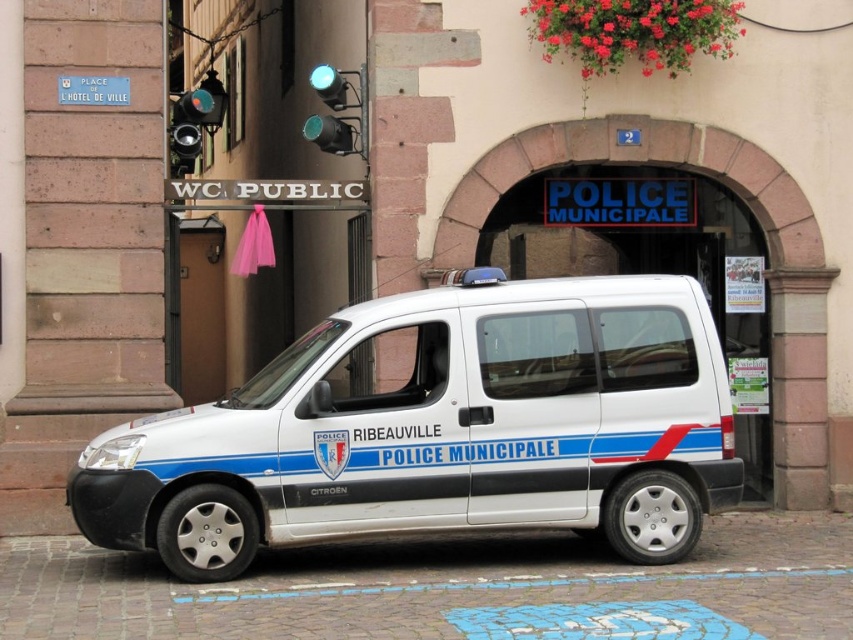
Question: Which point is closer to the camera?

Choices:
 (A) (509, 371)
 (B) (334, 150)

Answer: (A)

Question: Observing the image, what is the correct spatial positioning of white metallic van at center in reference to metallic green traffic light at upper center?

Choices:
 (A) right
 (B) left

Answer: (A)

Question: Is white metallic van at center smaller than metallic green traffic light at upper center?

Choices:
 (A) no
 (B) yes

Answer: (A)

Question: Can you confirm if white metallic van at center is wider than metallic green traffic light at upper center?

Choices:
 (A) no
 (B) yes

Answer: (B)